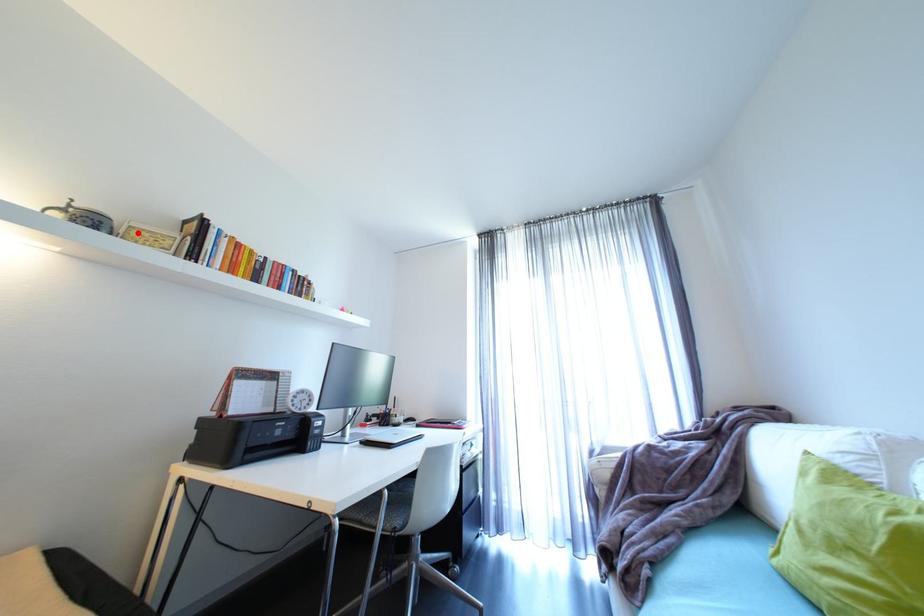
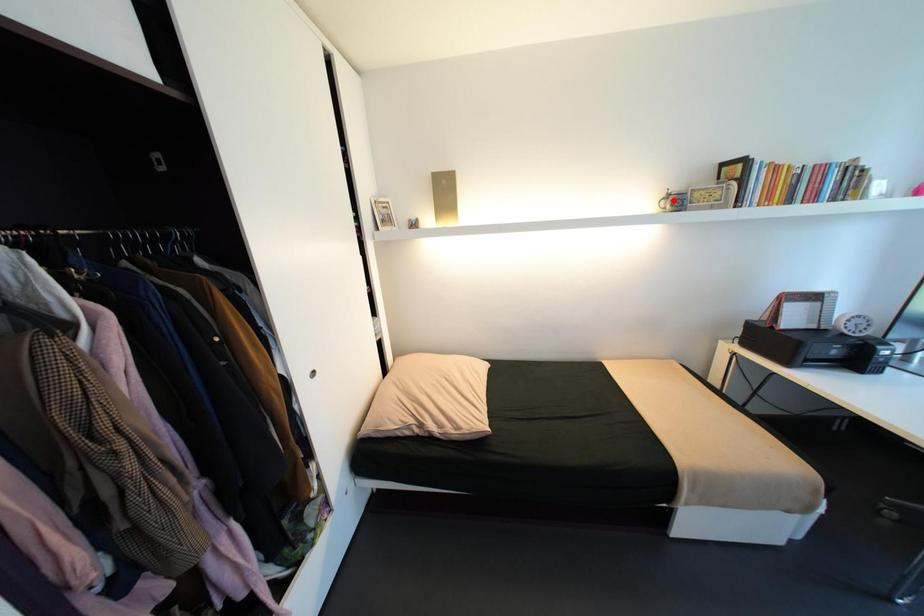
I am providing you with two images of the same scene from different viewpoints. A red point is marked on the first image and another point is marked on the second image. Is the red point in image1 aligned with the point shown in image2?

No